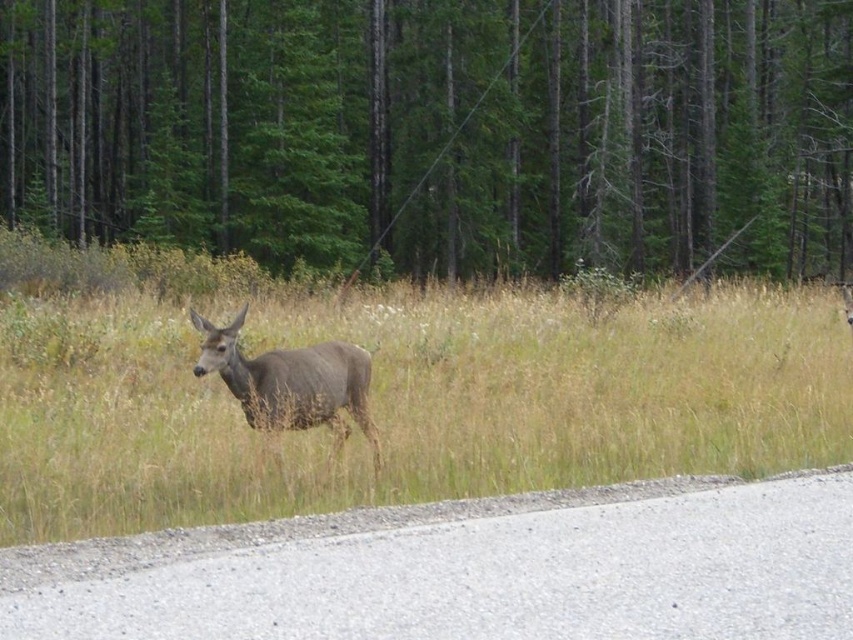
You are a hiker who wants to take a photo of the brown grass at center and the green matte tree at center. Which one should you focus on first if you want to capture both in your camera frame?

The green matte tree at center is above the brown grass at center, so you should focus on the green matte tree at center first to ensure both are in frame.

You are a photographer aiming to capture the brown matte deer at center and the green matte tree at center in a single frame. Based on their heights, which object should you focus on first to ensure both are in the shot?

The green matte tree at center is much taller than the brown matte deer at center. To ensure both are in the shot, focus on the green matte tree at center first as it occupies more vertical space.